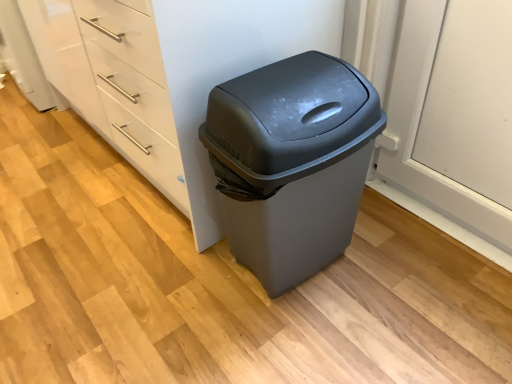
Image resolution: width=512 pixels, height=384 pixels. What do you see at coordinates (169, 74) in the screenshot?
I see `white glossy dresser at center` at bounding box center [169, 74].

You are a GUI agent. You are given a task and a screenshot of the screen. Output one action in this format:
    pyautogui.click(x=<x>, y=<y>)
    Task: Click on the white glossy dresser at center
    The height and width of the screenshot is (384, 512).
    Given the screenshot: What is the action you would take?
    pyautogui.click(x=169, y=74)

The image size is (512, 384). What do you see at coordinates (292, 163) in the screenshot?
I see `matte gray plastic trash can at center` at bounding box center [292, 163].

The width and height of the screenshot is (512, 384). I want to click on matte gray plastic trash can at center, so click(292, 163).

Image resolution: width=512 pixels, height=384 pixels. Find the location of `white glossy dresser at center`. white glossy dresser at center is located at coordinates (169, 74).

Considering the positions of objects matte gray plastic trash can at center and white glossy dresser at center in the image provided, who is more to the right, matte gray plastic trash can at center or white glossy dresser at center?

matte gray plastic trash can at center.

Does matte gray plastic trash can at center come in front of white glossy dresser at center?

Yes, matte gray plastic trash can at center is closer to the viewer.

Considering the positions of point (355, 128) and point (37, 35), is point (355, 128) closer or farther from the camera than point (37, 35)?

Point (355, 128).

From the image's perspective, is matte gray plastic trash can at center located beneath white glossy dresser at center?

Correct, matte gray plastic trash can at center appears lower than white glossy dresser at center in the image.

From a real-world perspective, who is located lower, matte gray plastic trash can at center or white glossy dresser at center?

From a 3D spatial view, matte gray plastic trash can at center is below.

Between matte gray plastic trash can at center and white glossy dresser at center, which one has larger width?

white glossy dresser at center.

Considering the relative sizes of matte gray plastic trash can at center and white glossy dresser at center in the image provided, is matte gray plastic trash can at center shorter than white glossy dresser at center?

Yes.

Who is bigger, matte gray plastic trash can at center or white glossy dresser at center?

white glossy dresser at center is bigger.

Is white glossy dresser at center inside matte gray plastic trash can at center?

No, white glossy dresser at center is located outside of matte gray plastic trash can at center.

Are matte gray plastic trash can at center and white glossy dresser at center beside each other?

matte gray plastic trash can at center and white glossy dresser at center are not in contact.

Is matte gray plastic trash can at center turned away from white glossy dresser at center?

Yes, matte gray plastic trash can at center is facing away from white glossy dresser at center.

Where is `waste container to the right of white glossy dresser at center`? This screenshot has height=384, width=512. waste container to the right of white glossy dresser at center is located at coordinates (292, 163).

Considering the relative positions of white glossy dresser at center and matte gray plastic trash can at center in the image provided, is white glossy dresser at center to the left or to the right of matte gray plastic trash can at center?

Clearly, white glossy dresser at center is on the left of matte gray plastic trash can at center in the image.

Is white glossy dresser at center in front of matte gray plastic trash can at center?

No, the depth of white glossy dresser at center is greater than that of matte gray plastic trash can at center.

Which is less distant, [98,43] or [307,248]?

Point [307,248]

From the image's perspective, which one is positioned lower, white glossy dresser at center or matte gray plastic trash can at center?

From the image's view, matte gray plastic trash can at center is below.

From a real-world perspective, is white glossy dresser at center positioned under matte gray plastic trash can at center based on gravity?

No, from a real-world perspective, white glossy dresser at center is not beneath matte gray plastic trash can at center.

Which object is thinner, white glossy dresser at center or matte gray plastic trash can at center?

With smaller width is matte gray plastic trash can at center.

Does white glossy dresser at center have a lesser height compared to matte gray plastic trash can at center?

No, white glossy dresser at center is not shorter than matte gray plastic trash can at center.

Does white glossy dresser at center have a smaller size compared to matte gray plastic trash can at center?

No.

Is matte gray plastic trash can at center inside white glossy dresser at center?

No, matte gray plastic trash can at center is not inside white glossy dresser at center.

In the scene shown: Is white glossy dresser at center in contact with matte gray plastic trash can at center?

white glossy dresser at center and matte gray plastic trash can at center are not in contact.

Is white glossy dresser at center positioned with its back to matte gray plastic trash can at center?

That's not correct — white glossy dresser at center is not looking away from matte gray plastic trash can at center.

What's the angular difference between white glossy dresser at center and matte gray plastic trash can at center's facing directions?

The angular difference between white glossy dresser at center and matte gray plastic trash can at center is 87.4 degrees.

Identify the location of waste container lying on the right of white glossy dresser at center. The height and width of the screenshot is (384, 512). (292, 163).

Locate an element on the screen. The width and height of the screenshot is (512, 384). dresser on the left of the matte gray plastic trash can at center is located at coordinates (169, 74).

You are a GUI agent. You are given a task and a screenshot of the screen. Output one action in this format:
    pyautogui.click(x=<x>, y=<y>)
    Task: Click on the waste container located on the right of white glossy dresser at center
    
    Given the screenshot: What is the action you would take?
    pyautogui.click(x=292, y=163)